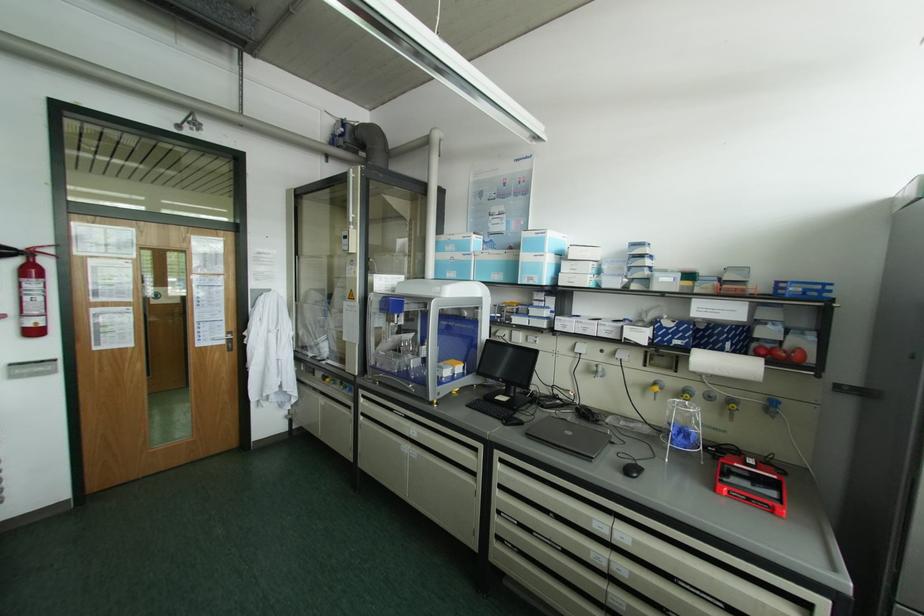
The image size is (924, 616). Find the location of `black drawer handle`. black drawer handle is located at coordinates (567, 507).